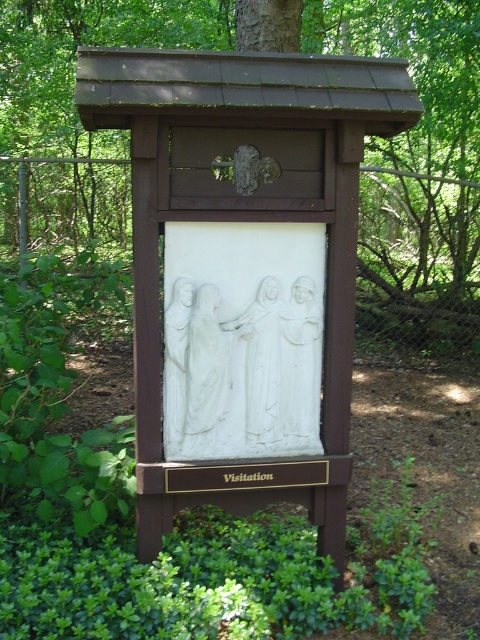
Question: Which object appears closest to the camera in this image?

Choices:
 (A) brown wood tree at center
 (B) white stone relief at center
 (C) white marble statue at center

Answer: (B)

Question: Among these objects, which one is farthest from the camera?

Choices:
 (A) brown wood tree at center
 (B) white marble statue at center
 (C) white stone relief at center

Answer: (A)

Question: Is brown wood tree at center closer to the viewer compared to white marble statue at center?

Choices:
 (A) no
 (B) yes

Answer: (A)

Question: Is brown wood tree at center further to the viewer compared to white stone relief at center?

Choices:
 (A) no
 (B) yes

Answer: (B)

Question: Estimate the real-world distances between objects in this image. Which object is farther from the brown wood tree at center?

Choices:
 (A) white marble statue at center
 (B) white stone relief at center

Answer: (B)

Question: From the image, what is the correct spatial relationship of brown wood tree at center in relation to white stone relief at center?

Choices:
 (A) below
 (B) above

Answer: (B)